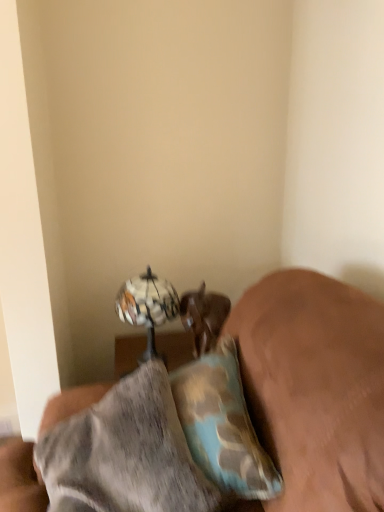
Question: Is brown leather dog at lower center next to camouflage fabric pillow at lower right?

Choices:
 (A) no
 (B) yes

Answer: (A)

Question: Is brown leather dog at lower center not near camouflage fabric pillow at lower right?

Choices:
 (A) yes
 (B) no

Answer: (B)

Question: Can you confirm if brown leather dog at lower center is wider than camouflage fabric pillow at lower right?

Choices:
 (A) no
 (B) yes

Answer: (B)

Question: Considering the relative positions of brown leather dog at lower center and camouflage fabric pillow at lower right in the image provided, is brown leather dog at lower center to the left of camouflage fabric pillow at lower right from the viewer's perspective?

Choices:
 (A) yes
 (B) no

Answer: (A)

Question: Considering the relative sizes of brown leather dog at lower center and camouflage fabric pillow at lower right in the image provided, is brown leather dog at lower center thinner than camouflage fabric pillow at lower right?

Choices:
 (A) no
 (B) yes

Answer: (A)

Question: From the image's perspective, is camouflage-patterned pillow at center located above or below metallic reflective globe at upper center?

Choices:
 (A) below
 (B) above

Answer: (A)

Question: Considering the positions of camouflage-patterned pillow at center and metallic reflective globe at upper center in the image, is camouflage-patterned pillow at center taller or shorter than metallic reflective globe at upper center?

Choices:
 (A) short
 (B) tall

Answer: (B)

Question: In the image, is camouflage-patterned pillow at center positioned in front of or behind metallic reflective globe at upper center?

Choices:
 (A) front
 (B) behind

Answer: (A)

Question: From a real-world perspective, relative to metallic reflective globe at upper center, is camouflage-patterned pillow at center vertically above or below?

Choices:
 (A) below
 (B) above

Answer: (A)

Question: In terms of width, does camouflage fabric pillow at lower right look wider or thinner when compared to camouflage-patterned pillow at center?

Choices:
 (A) wide
 (B) thin

Answer: (B)

Question: Is camouflage fabric pillow at lower right taller or shorter than camouflage-patterned pillow at center?

Choices:
 (A) short
 (B) tall

Answer: (A)

Question: Based on their sizes in the image, would you say camouflage fabric pillow at lower right is bigger or smaller than camouflage-patterned pillow at center?

Choices:
 (A) big
 (B) small

Answer: (B)

Question: From a real-world perspective, is camouflage fabric pillow at lower right physically located above or below camouflage-patterned pillow at center?

Choices:
 (A) above
 (B) below

Answer: (A)

Question: Is brown leather dog at lower center in front of or behind metallic reflective globe at upper center in the image?

Choices:
 (A) behind
 (B) front

Answer: (A)

Question: From the image's perspective, relative to metallic reflective globe at upper center, is brown leather dog at lower center above or below?

Choices:
 (A) above
 (B) below

Answer: (B)